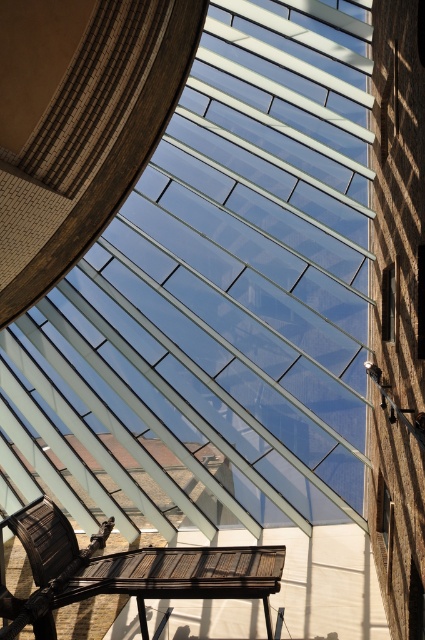
Between wooden slats bench at lower center and brown tile roof at center, which one has more height?

With more height is wooden slats bench at lower center.

Does wooden slats bench at lower center appear on the left side of brown tile roof at center?

In fact, wooden slats bench at lower center is to the right of brown tile roof at center.

Who is more distant from viewer, (78,582) or (204,444)?

The point (204,444) is behind.

Identify the location of wooden slats bench at lower center. Image resolution: width=425 pixels, height=640 pixels. 127,572.